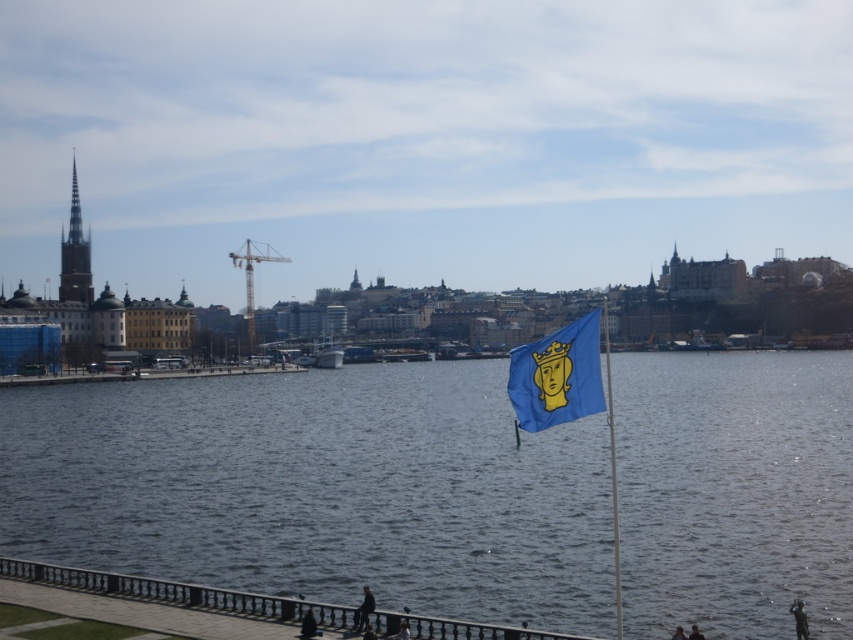
You are a tourist standing at the waterfront and want to take a photo of the blue fabric flag at right and the blue water at center. Which object should you aim your camera at first to ensure both are in the frame?

You should aim your camera at the blue fabric flag at right first because the blue water at center is located below it, allowing both to be captured in the frame when centered on the flag.